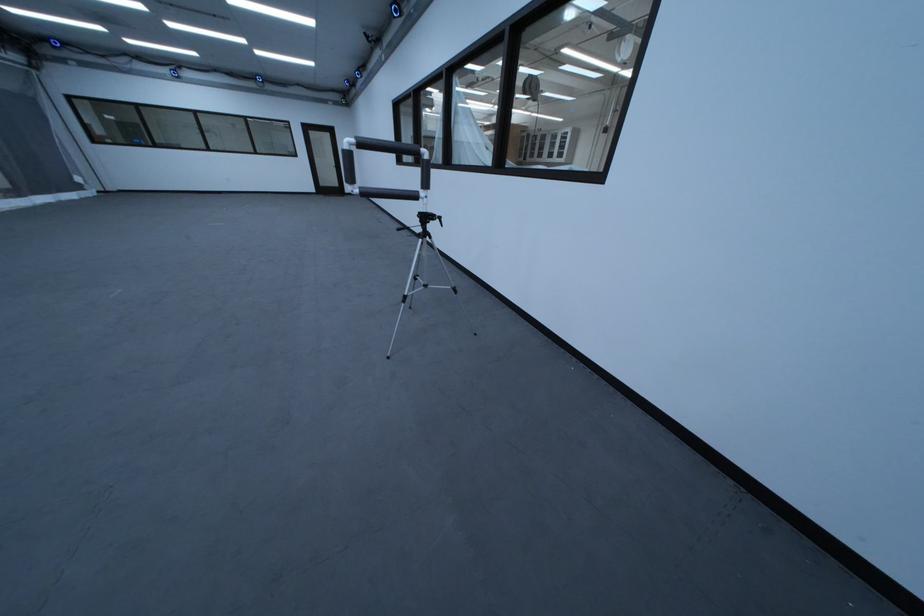
What do you see at coordinates (337, 161) in the screenshot? I see `the black door handle` at bounding box center [337, 161].